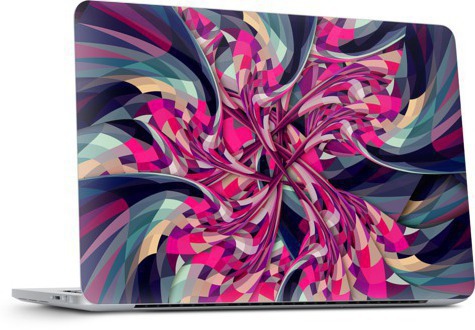
The image size is (475, 330). What are the coordinates of `space to left of laptop` in the screenshot? It's located at (23, 167).